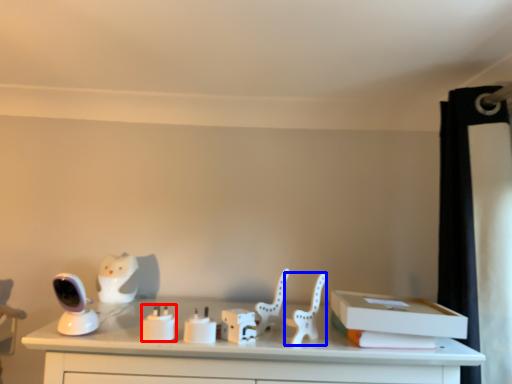
Question: Which object is further to the camera taking this photo, candle holder (highlighted by a red box) or chair (highlighted by a blue box)?

Choices:
 (A) candle holder
 (B) chair

Answer: (B)